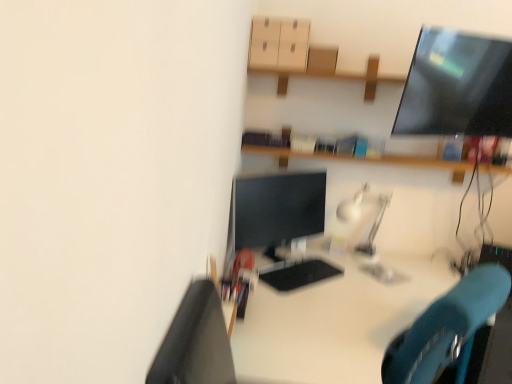
Question: From the image's perspective, does white glossy desk at center appear lower than matte cardboard drawer at upper center?

Choices:
 (A) no
 (B) yes

Answer: (B)

Question: From a real-world perspective, is white glossy desk at center physically below matte cardboard drawer at upper center?

Choices:
 (A) no
 (B) yes

Answer: (B)

Question: Can you confirm if white glossy desk at center is positioned to the right of matte cardboard drawer at upper center?

Choices:
 (A) no
 (B) yes

Answer: (B)

Question: Is white glossy desk at center further to camera compared to matte cardboard drawer at upper center?

Choices:
 (A) yes
 (B) no

Answer: (B)

Question: Is white glossy desk at center next to matte cardboard drawer at upper center?

Choices:
 (A) yes
 (B) no

Answer: (B)

Question: Can you confirm if white glossy desk at center is thinner than matte cardboard drawer at upper center?

Choices:
 (A) yes
 (B) no

Answer: (B)

Question: Is matte black monitor at center beside matte cardboard drawer at upper center?

Choices:
 (A) yes
 (B) no

Answer: (B)

Question: From the image's perspective, is matte black monitor at center beneath matte cardboard drawer at upper center?

Choices:
 (A) no
 (B) yes

Answer: (B)

Question: Is matte cardboard drawer at upper center inside matte black monitor at center?

Choices:
 (A) yes
 (B) no

Answer: (B)

Question: Is matte black monitor at center positioned before matte cardboard drawer at upper center?

Choices:
 (A) yes
 (B) no

Answer: (A)

Question: Can you confirm if matte black monitor at center is thinner than matte cardboard drawer at upper center?

Choices:
 (A) no
 (B) yes

Answer: (B)

Question: From the image's perspective, does matte black monitor at center appear higher than matte cardboard drawer at upper center?

Choices:
 (A) no
 (B) yes

Answer: (A)

Question: Is matte black monitor at center far from white glossy desk at center?

Choices:
 (A) no
 (B) yes

Answer: (A)